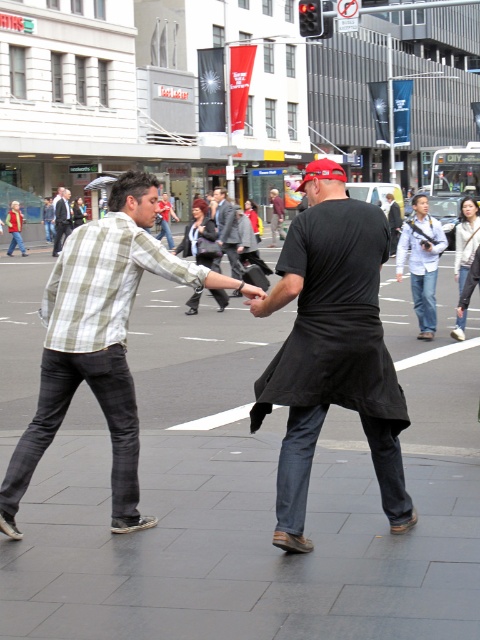
Can you confirm if black matte shirt at center is positioned below matte black suit at left?

Yes.

Does point (313, 285) lie in front of point (56, 237)?

That is True.

Is point (288, 483) closer to viewer compared to point (56, 205)?

Yes, it is in front of point (56, 205).

The width and height of the screenshot is (480, 640). Find the location of `black matte shirt at center`. black matte shirt at center is located at coordinates (332, 348).

Who is shorter, black matte shirt at center or checkered fabric shirt at left?

checkered fabric shirt at left is shorter.

Between black matte shirt at center and checkered fabric shirt at left, which one appears on the left side from the viewer's perspective?

Positioned to the left is checkered fabric shirt at left.

Locate an element on the screen. black matte shirt at center is located at coordinates (332, 348).

Image resolution: width=480 pixels, height=640 pixels. What are the coordinates of `black matte shirt at center` in the screenshot? It's located at (332, 348).

Is black asphalt at center wider than black matte shirt at center?

Correct, the width of black asphalt at center exceeds that of black matte shirt at center.

This screenshot has height=640, width=480. What do you see at coordinates (252, 496) in the screenshot? I see `black asphalt at center` at bounding box center [252, 496].

At what (x,y) coordinates should I click in order to perform the action: click on black asphalt at center. Please return your answer as a coordinate pair (x, y). Looking at the image, I should click on (252, 496).

Identify the location of black asphalt at center. (252, 496).